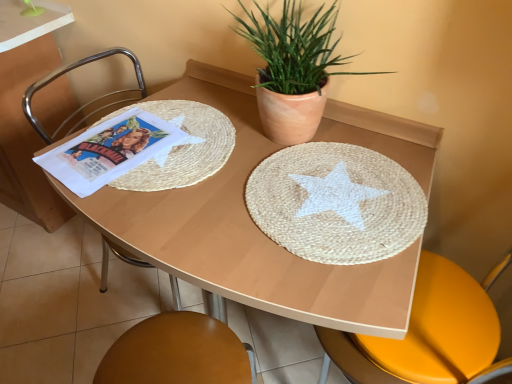
Where is `free space between brushed metal chair at left and wooden table at center`? free space between brushed metal chair at left and wooden table at center is located at coordinates (99, 320).